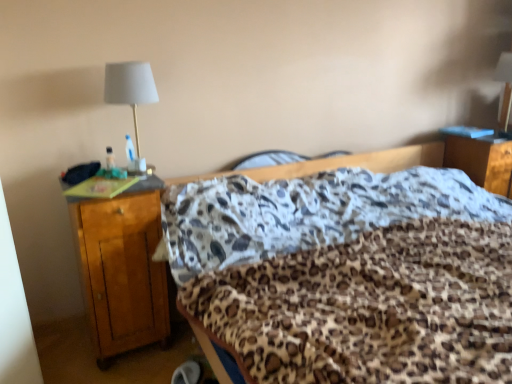
Question: Is wooden nightstand at lower right, the 1th nightstand when ordered from right to left, closer to camera compared to matte white lampshade at upper left?

Choices:
 (A) no
 (B) yes

Answer: (A)

Question: Is wooden nightstand at lower right, the second nightstand positioned from the left, positioned behind matte white lampshade at upper left?

Choices:
 (A) no
 (B) yes

Answer: (B)

Question: Is wooden nightstand at lower right, the second nightstand positioned from the left, thinner than matte white lampshade at upper left?

Choices:
 (A) no
 (B) yes

Answer: (A)

Question: Is wooden nightstand at lower right, the second nightstand positioned from the left, shorter than matte white lampshade at upper left?

Choices:
 (A) yes
 (B) no

Answer: (A)

Question: Would you say wooden nightstand at lower right, the 1th nightstand when ordered from right to left, is outside matte white lampshade at upper left?

Choices:
 (A) yes
 (B) no

Answer: (A)

Question: Considering the relative sizes of wooden nightstand at lower right, the 1th nightstand positioned from the back, and matte white lampshade at upper left in the image provided, is wooden nightstand at lower right, the 1th nightstand positioned from the back, smaller than matte white lampshade at upper left?

Choices:
 (A) no
 (B) yes

Answer: (A)

Question: From a real-world perspective, is wooden nightstand at left, the 1th nightstand in the front-to-back sequence, located higher than leopard print fabric at center?

Choices:
 (A) no
 (B) yes

Answer: (B)

Question: Considering the relative sizes of wooden nightstand at left, which is the second nightstand in right-to-left order, and leopard print fabric at center in the image provided, is wooden nightstand at left, which is the second nightstand in right-to-left order, thinner than leopard print fabric at center?

Choices:
 (A) no
 (B) yes

Answer: (B)

Question: Is wooden nightstand at left, the 1th nightstand in the front-to-back sequence, closer to camera compared to leopard print fabric at center?

Choices:
 (A) no
 (B) yes

Answer: (A)

Question: Is wooden nightstand at left, the 1th nightstand in the front-to-back sequence, to the right of leopard print fabric at center from the viewer's perspective?

Choices:
 (A) yes
 (B) no

Answer: (B)

Question: Is wooden nightstand at left, which is the second nightstand in right-to-left order, outside of leopard print fabric at center?

Choices:
 (A) yes
 (B) no

Answer: (A)

Question: Would you say wooden nightstand at left, which is the second nightstand in right-to-left order, contains leopard print fabric at center?

Choices:
 (A) no
 (B) yes

Answer: (A)

Question: Is wooden nightstand at lower right, the 1th nightstand when ordered from right to left, wider than leopard print fabric at center?

Choices:
 (A) yes
 (B) no

Answer: (B)